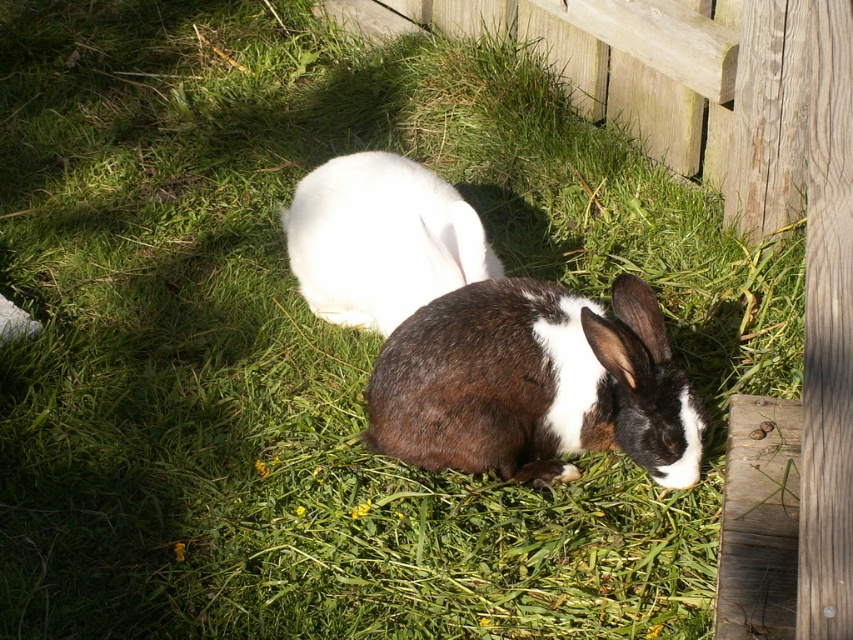
You are a photographer trying to capture both rabbits in a single frame. Given that the camera can only focus on objects within a 30 cm width, can you determine if both the brown fuzzy rabbit at center and the white fluffy rabbit at center can fit within the camera frame?

The brown fuzzy rabbit at center might be wider than white fluffy rabbit at center, so it depends on the exact width of the brown fuzzy rabbit at center. If it is wider than 30 cm, then both rabbits may not fit within the camera frame. Otherwise, they might fit.

You are a photographer trying to capture a closeup of the rabbits. You notice two points of interest in the scene marked as point (x=395, y=371) and point (x=373, y=291). Which point should you focus on to get a clearer image of the rabbit closer to the camera?

Point (x=395, y=371) is closer to the camera than point (x=373, y=291), so focusing on point (x=395, y=371) will capture a clearer image of the rabbit closer to the camera.